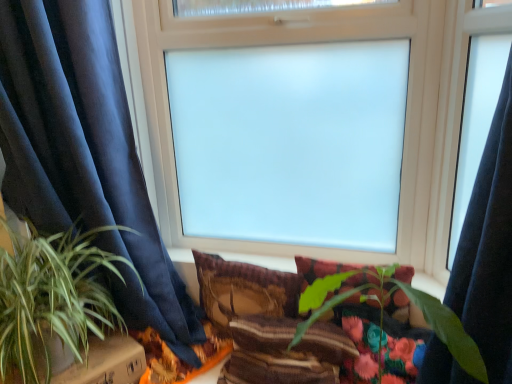
Question: Is green leafy plant at left, marked as the 2th houseplant in a right-to-left arrangement, situated inside plush fabric pillow at center, which is the third pillow from left to right, or outside?

Choices:
 (A) outside
 (B) inside

Answer: (A)

Question: From a real-world perspective, relative to plush fabric pillow at center, which is counted as the first pillow, starting from the right, is green leafy plant at left, marked as the 2th houseplant in a right-to-left arrangement, vertically above or below?

Choices:
 (A) above
 (B) below

Answer: (A)

Question: Which object is the closest to the green leafy plant at left, marked as the 1th houseplant in a left-to-right arrangement?

Choices:
 (A) cardboard box at lower left
 (B) green leafy plant at center, placed as the 2th houseplant when sorted from left to right
 (C) plush fabric pillow at center, which is the third pillow from left to right
 (D) dark blue fabric curtain at left
 (E) textured brown pillow at center, the first pillow from the left

Answer: (A)

Question: Which is nearer to the plush fabric pillow at center, which is counted as the first pillow, starting from the right?

Choices:
 (A) dark blue fabric curtain at left
 (B) textured brown pillow at center, the first pillow from the left
 (C) green leafy plant at left, marked as the 1th houseplant in a left-to-right arrangement
 (D) striped fabric pillow at center, the second pillow viewed from the right
 (E) cardboard box at lower left

Answer: (B)